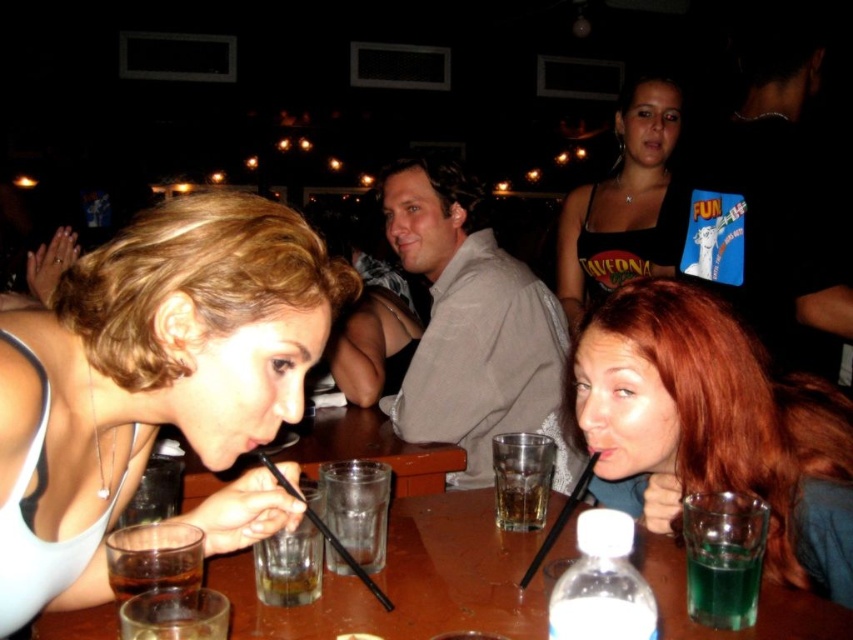
Question: Among these points, which one is farthest from the camera?

Choices:
 (A) (163, 586)
 (B) (351, 600)
 (C) (157, 376)
 (D) (753, 259)

Answer: (D)

Question: Is matte white tank top at center above green translucent glass at lower right?

Choices:
 (A) yes
 (B) no

Answer: (A)

Question: Which object is the closest to the translucent glass at lower left?

Choices:
 (A) green translucent glass at lower right
 (B) matte white tank top at center
 (C) reddish-brown hair at center

Answer: (B)

Question: Is light beige shirt at center smaller than translucent glass at lower left?

Choices:
 (A) no
 (B) yes

Answer: (A)

Question: Which of these objects is positioned farthest from the black tank top at upper center?

Choices:
 (A) green translucent glass at lower right
 (B) translucent glass at lower center
 (C) matte white tank top at center
 (D) black cotton shirt at upper right

Answer: (B)

Question: Is matte white tank top at center closer to camera compared to translucent glass at lower left?

Choices:
 (A) no
 (B) yes

Answer: (B)